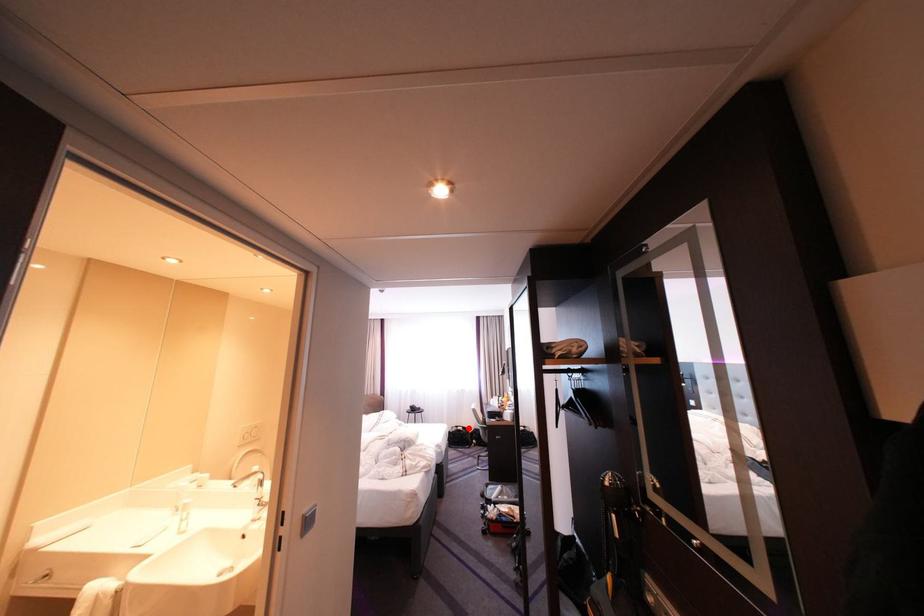
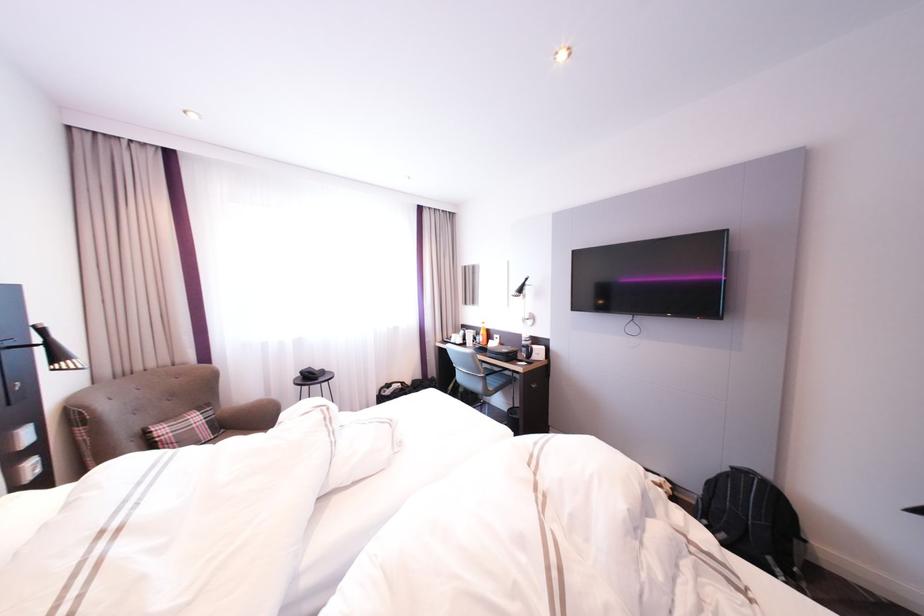
Question: I am providing you with two images of the same scene from different viewpoints. In image1, a red point is highlighted. Considering the same 3D point in image2, which of the following is correct?

Choices:
 (A) It is closer
 (B) It is farther

Answer: (A)